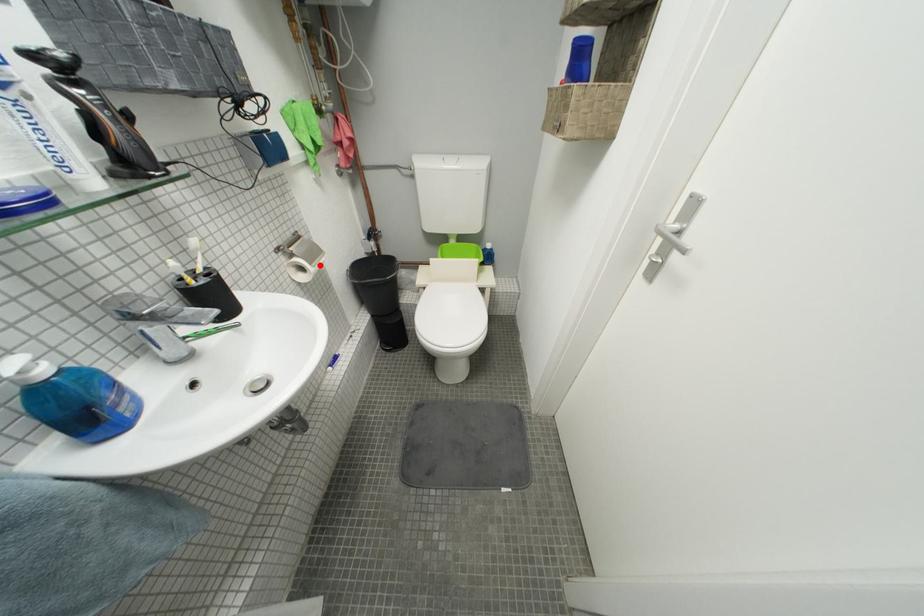
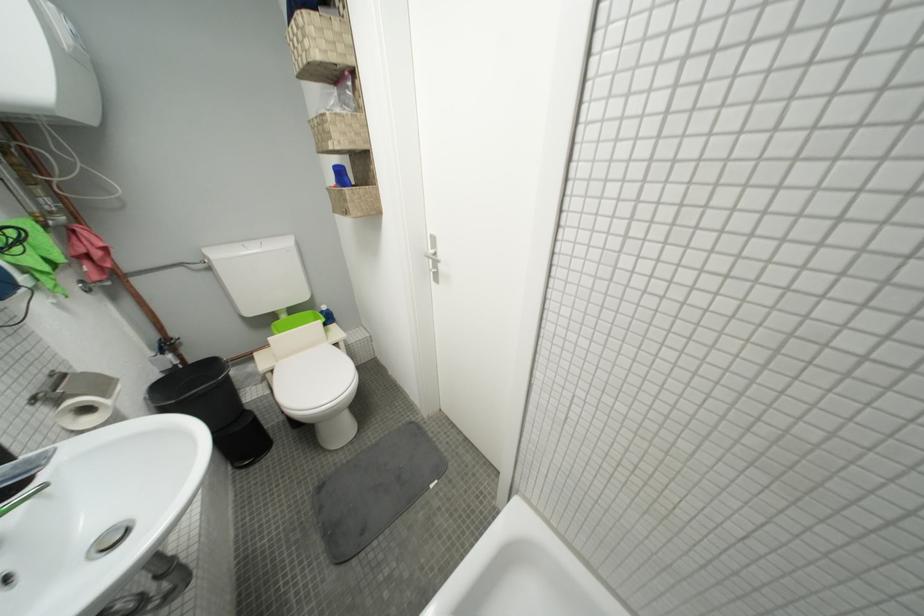
Where in the second image is the point corresponding to the highlighted location from the first image?

(113, 397)